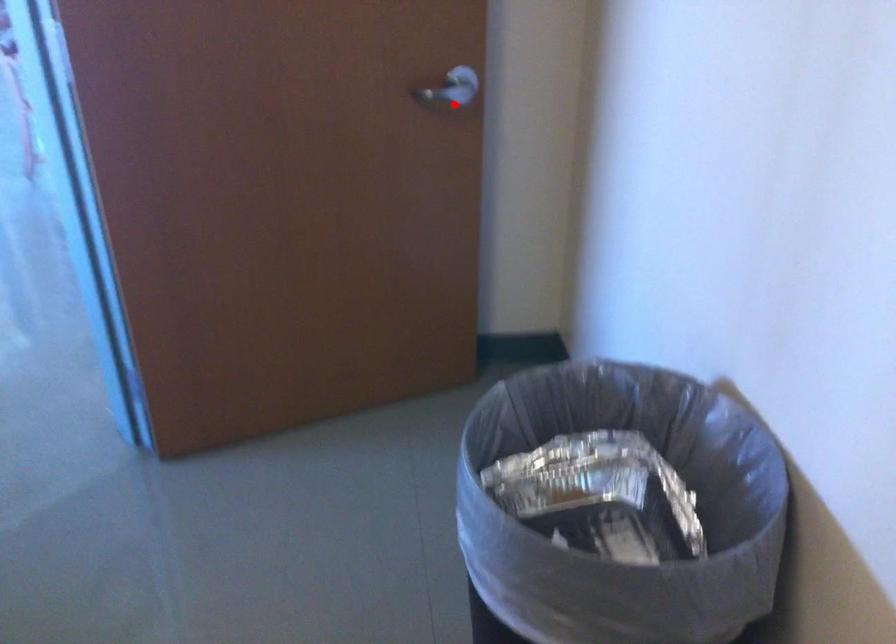
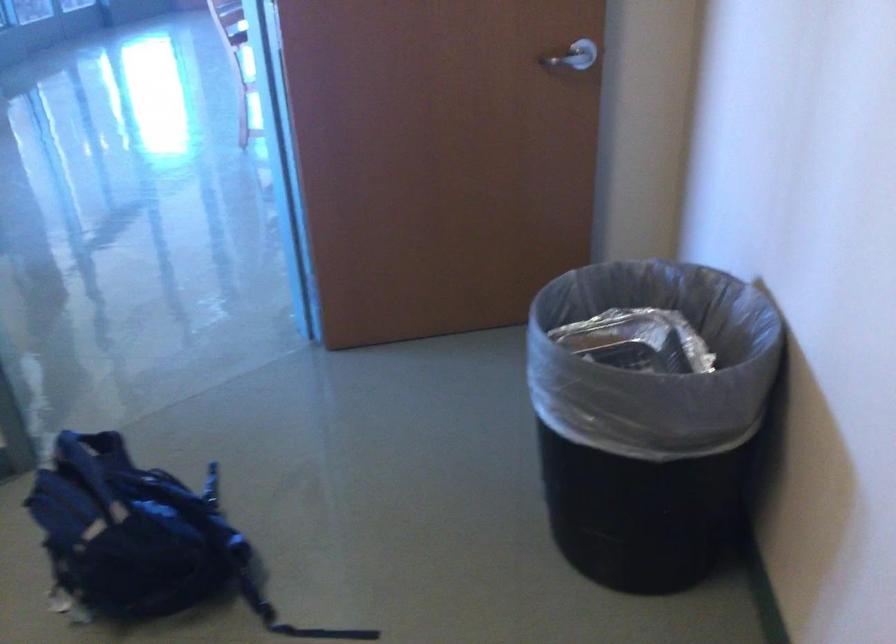
The point at the highlighted location is marked in the first image. Where is the corresponding point in the second image?

(571, 60)